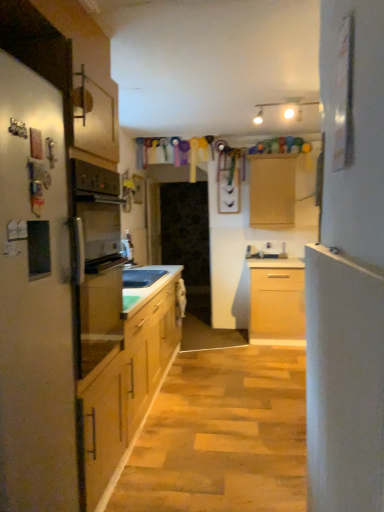
Question: Considering their positions, is matte white refrigerator at left located in front of or behind wooden cabinet at center?

Choices:
 (A) front
 (B) behind

Answer: (A)

Question: From the image's perspective, is matte white refrigerator at left positioned above or below wooden cabinet at center?

Choices:
 (A) below
 (B) above

Answer: (A)

Question: Based on their relative distances, which object is farther from the matte white refrigerator at left?

Choices:
 (A) wooden cabinet at center
 (B) white smooth door at right

Answer: (A)

Question: Which object is positioned closest to the white smooth door at right?

Choices:
 (A) matte white refrigerator at left
 (B) wooden cabinet at center

Answer: (A)